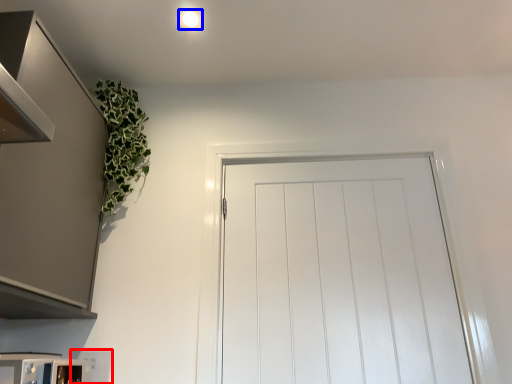
Question: Which object is closer to the camera taking this photo, appliance (highlighted by a red box) or lighting (highlighted by a blue box)?

Choices:
 (A) appliance
 (B) lighting

Answer: (A)